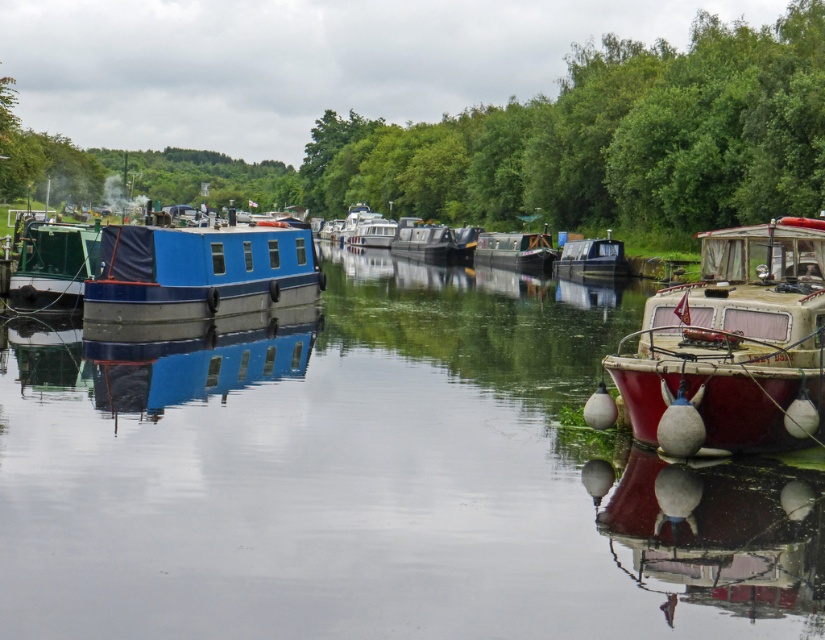
Question: Can you confirm if smooth water at center is positioned to the right of rustic wood boat at right?

Choices:
 (A) yes
 (B) no

Answer: (B)

Question: Which is farther from the green matte boat at left?

Choices:
 (A) blue painted wooden barge at center
 (B) blue painted wooden canal boat at center

Answer: (B)

Question: Which object appears closest to the camera in this image?

Choices:
 (A) blue matte houseboat at left
 (B) green matte boat at left

Answer: (A)

Question: Does green matte boat at left lie behind blue painted wooden canal boat at center?

Choices:
 (A) no
 (B) yes

Answer: (A)

Question: Observing the image, what is the correct spatial positioning of blue matte houseboat at left in reference to wooden cabin cruiser at center?

Choices:
 (A) right
 (B) left

Answer: (B)

Question: Which of these objects is positioned closest to the green matte boat at left?

Choices:
 (A) smooth water at center
 (B) wooden cabin cruiser at center

Answer: (A)